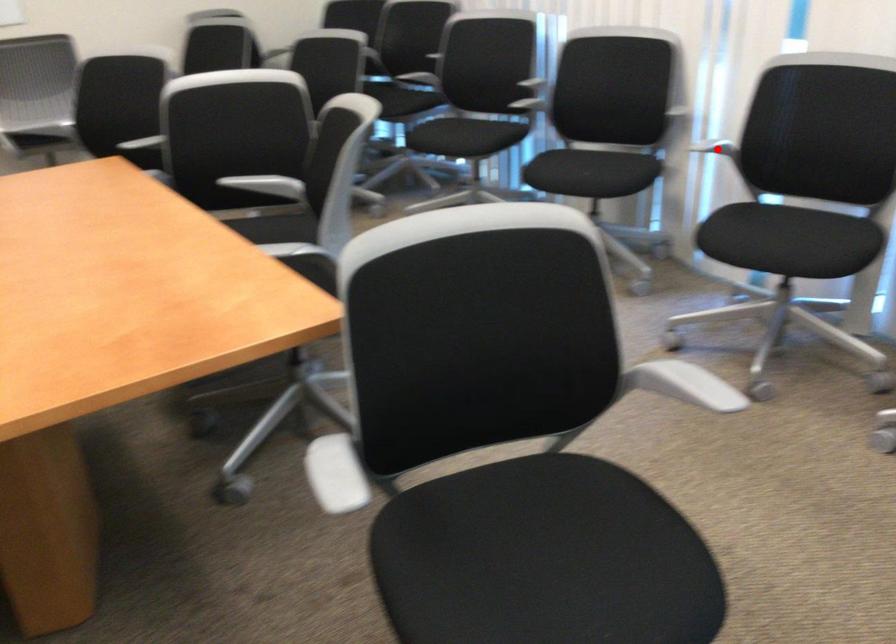
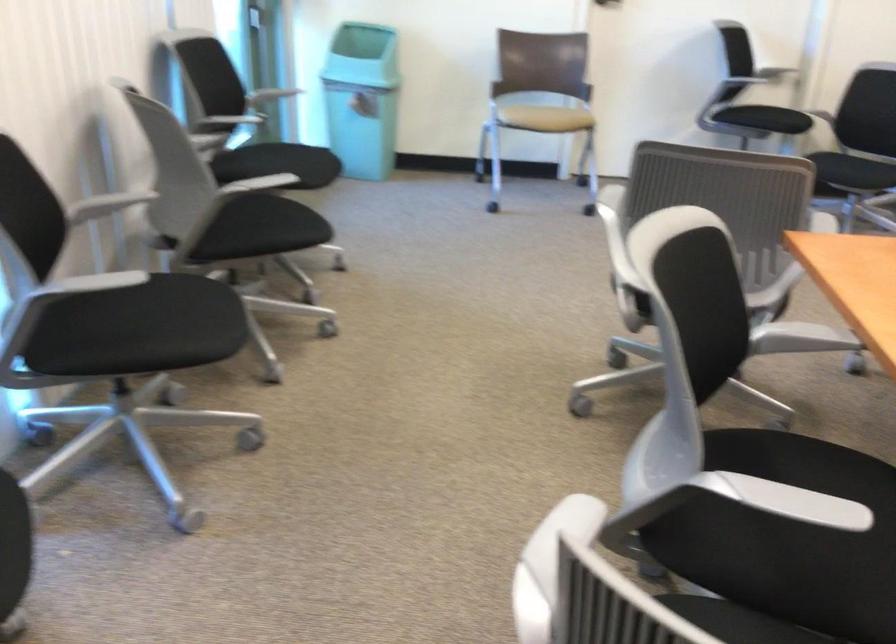
Question: I am providing you with two images of the same scene from different viewpoints. A red point is marked on the first image. Can you still see the location of the red point in image 2?

Choices:
 (A) Yes
 (B) No

Answer: (B)